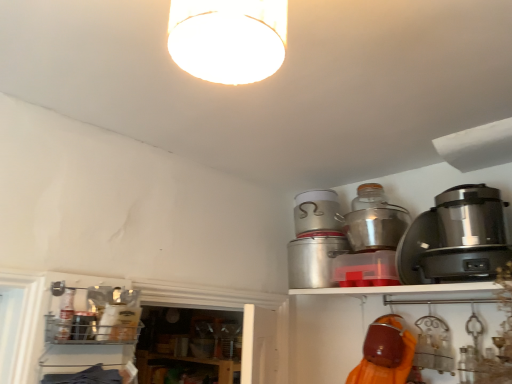
Question: From the image's perspective, does metallic silver pot at upper center, the 2th appliance positioned from the right, appear higher than metallic silver canister at upper right, positioned as the third appliance in right-to-left order?

Choices:
 (A) no
 (B) yes

Answer: (B)

Question: Does metallic silver pot at upper center, which is the third appliance from left to right, come in front of metallic silver canister at upper right, positioned as the third appliance in right-to-left order?

Choices:
 (A) no
 (B) yes

Answer: (A)

Question: Is metallic silver pot at upper center, the 2th appliance positioned from the right, far from metallic silver canister at upper right, positioned as the third appliance in right-to-left order?

Choices:
 (A) yes
 (B) no

Answer: (B)

Question: Is metallic silver pot at upper center, the 2th appliance positioned from the right, not inside metallic silver canister at upper right, positioned as the third appliance in right-to-left order?

Choices:
 (A) no
 (B) yes

Answer: (B)

Question: Are metallic silver pot at upper center, which is the third appliance from left to right, and metallic silver canister at upper right, positioned as the third appliance in right-to-left order, beside each other?

Choices:
 (A) no
 (B) yes

Answer: (A)

Question: Visually, is metallic silver canister at upper right, the second appliance from the left, positioned to the left or to the right of metallic silver pot at upper right, which is the 4th appliance in left-to-right order?

Choices:
 (A) right
 (B) left

Answer: (B)

Question: Based on their sizes in the image, would you say metallic silver canister at upper right, the second appliance from the left, is bigger or smaller than metallic silver pot at upper right, placed as the 1th appliance when sorted from right to left?

Choices:
 (A) small
 (B) big

Answer: (B)

Question: From a real-world perspective, is metallic silver canister at upper right, positioned as the third appliance in right-to-left order, physically located above or below metallic silver pot at upper right, placed as the 1th appliance when sorted from right to left?

Choices:
 (A) below
 (B) above

Answer: (A)

Question: Is point (322, 263) closer or farther from the camera than point (394, 240)?

Choices:
 (A) closer
 (B) farther

Answer: (B)

Question: Is metallic silver pot at upper center, which is the third appliance from left to right, to the left or to the right of brushed metal canister at lower left, the fourth appliance viewed from the right, in the image?

Choices:
 (A) left
 (B) right

Answer: (B)

Question: From a real-world perspective, is metallic silver pot at upper center, which is the third appliance from left to right, above or below brushed metal canister at lower left, the fourth appliance viewed from the right?

Choices:
 (A) above
 (B) below

Answer: (A)

Question: Is metallic silver pot at upper center, which is the third appliance from left to right, spatially inside brushed metal canister at lower left, placed as the 1th appliance when sorted from left to right, or outside of it?

Choices:
 (A) inside
 (B) outside

Answer: (B)

Question: Is point (300, 213) positioned closer to the camera than point (80, 311)?

Choices:
 (A) closer
 (B) farther

Answer: (B)

Question: From a real-world perspective, is brushed metal canister at lower left, placed as the 1th appliance when sorted from left to right, positioned above or below metallic silver pot at upper center, which is the third appliance from left to right?

Choices:
 (A) below
 (B) above

Answer: (A)

Question: Looking at their shapes, would you say brushed metal canister at lower left, placed as the 1th appliance when sorted from left to right, is wider or thinner than metallic silver pot at upper center, the 2th appliance positioned from the right?

Choices:
 (A) wide
 (B) thin

Answer: (B)